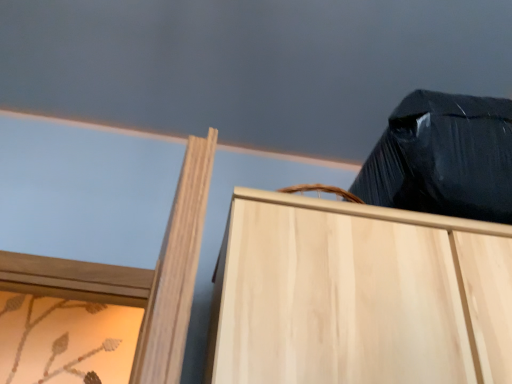
Image resolution: width=512 pixels, height=384 pixels. Identify the location of empty space that is ontop of black plastic bag at upper right (from a real-world perspective). (234, 72).